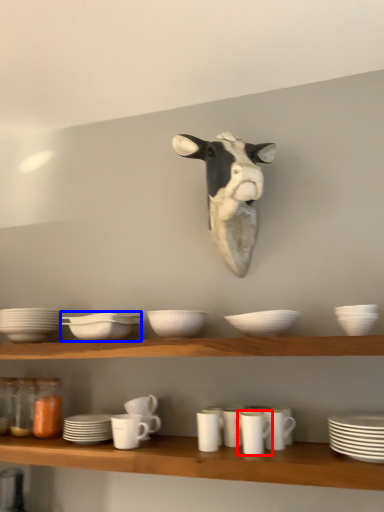
Question: Which point is closer to the camera, tableware (highlighted by a red box) or tableware (highlighted by a blue box)?

Choices:
 (A) tableware
 (B) tableware

Answer: (A)